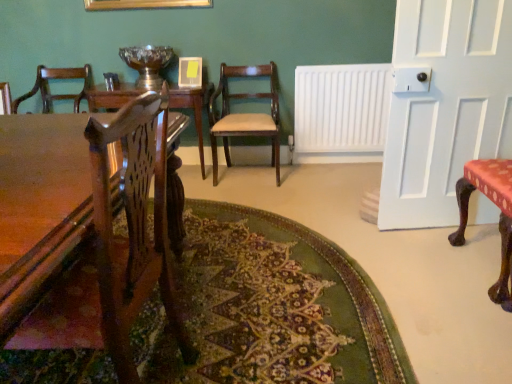
Find the location of a particular element. vacant area to the left of red fabric-covered chair at right, the first chair when ordered from right to left is located at coordinates (421, 274).